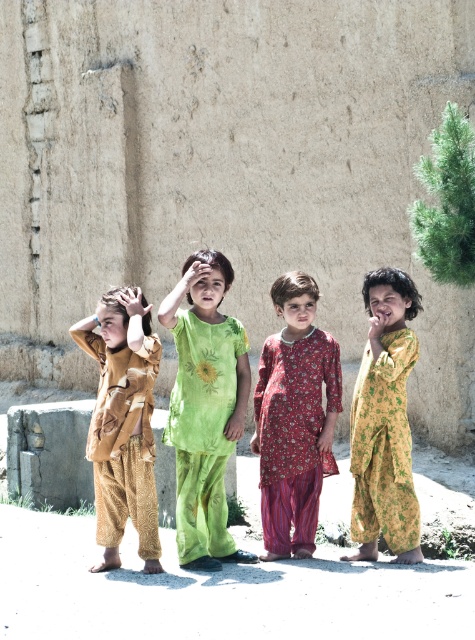
Can you confirm if yellow floral dress at right is smaller than smooth skin hand at center?

Incorrect, yellow floral dress at right is not smaller in size than smooth skin hand at center.

Is yellow floral dress at right positioned in front of smooth skin hand at center?

Yes, yellow floral dress at right is in front of smooth skin hand at center.

This screenshot has width=475, height=640. What are the coordinates of `yellow floral dress at right` in the screenshot? It's located at (383, 445).

Is green fabric dress at center closer to the viewer compared to matte green hand at center?

Yes, it is in front of matte green hand at center.

Which is in front, point (221, 369) or point (182, 276)?

Positioned in front is point (221, 369).

Identify the location of green fabric dress at center. This screenshot has width=475, height=640. (202, 429).

Does floral printed dress at center have a greater height compared to matte green hand at center?

Indeed, floral printed dress at center has a greater height compared to matte green hand at center.

The width and height of the screenshot is (475, 640). Find the location of `floral printed dress at center`. floral printed dress at center is located at coordinates (294, 435).